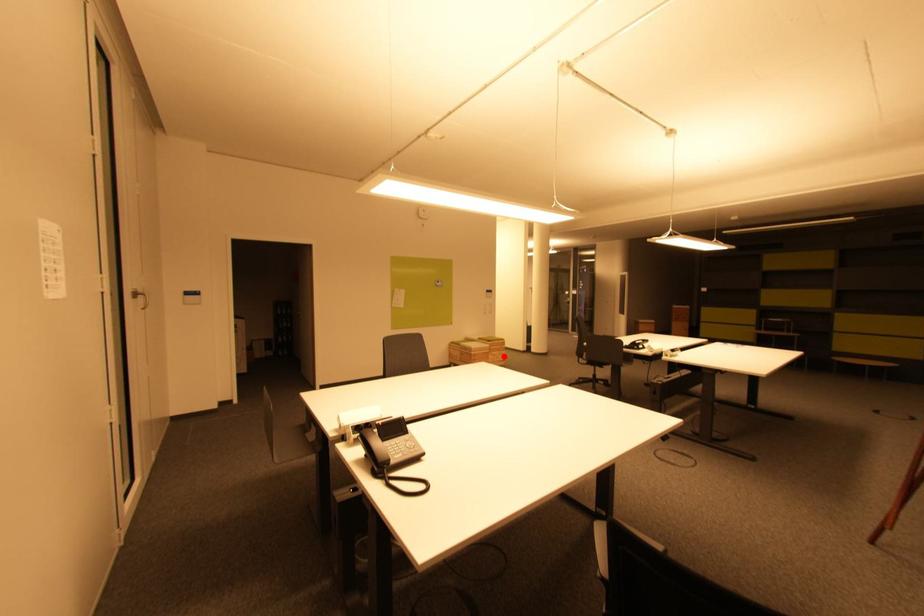
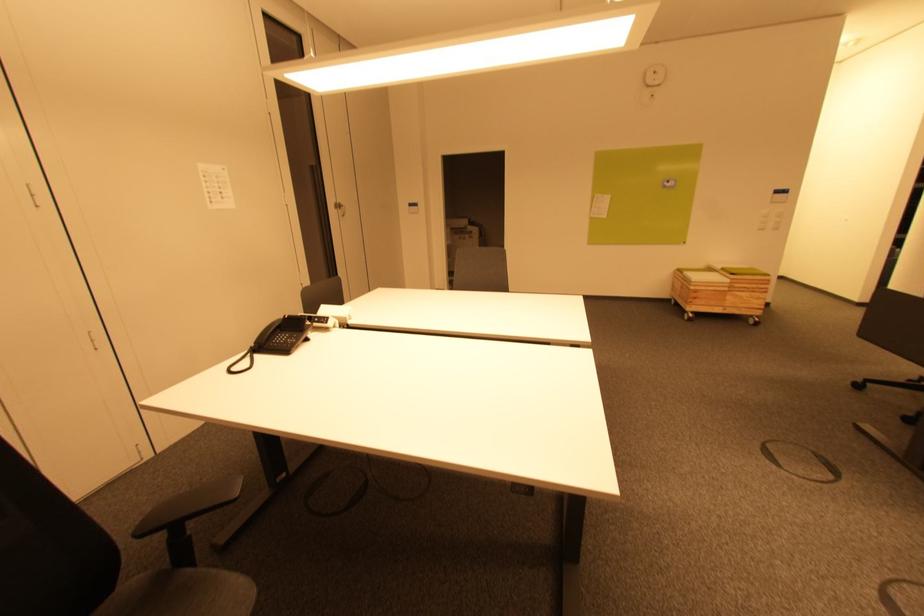
In the second image, find the point that corresponds to the highlighted location in the first image.

(756, 300)